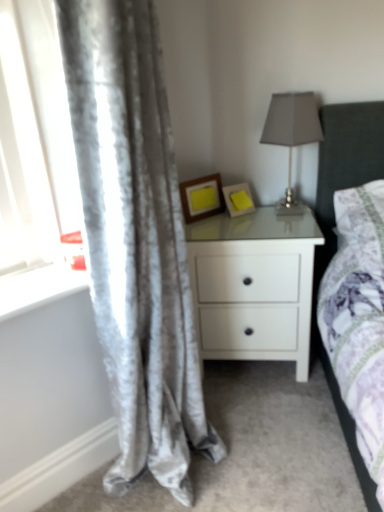
Question: Can you confirm if white glossy window sill at lower left is wider than white glossy nightstand at center?

Choices:
 (A) no
 (B) yes

Answer: (A)

Question: From the image's perspective, does white glossy window sill at lower left appear higher than white glossy nightstand at center?

Choices:
 (A) yes
 (B) no

Answer: (A)

Question: Is white glossy window sill at lower left positioned behind white glossy nightstand at center?

Choices:
 (A) yes
 (B) no

Answer: (B)

Question: From the image's perspective, is white glossy window sill at lower left under white glossy nightstand at center?

Choices:
 (A) no
 (B) yes

Answer: (A)

Question: Could you tell me if white glossy window sill at lower left is turned towards white glossy nightstand at center?

Choices:
 (A) yes
 (B) no

Answer: (B)

Question: Is satin gray lampshade at upper right bigger or smaller than yellow matte picture frame at upper center, placed as the second picture frame when sorted from left to right?

Choices:
 (A) big
 (B) small

Answer: (A)

Question: Relative to yellow matte picture frame at upper center, which ranks as the first picture frame in right-to-left order, is satin gray lampshade at upper right in front or behind?

Choices:
 (A) behind
 (B) front

Answer: (B)

Question: Is point (286, 105) positioned closer to the camera than point (235, 214)?

Choices:
 (A) farther
 (B) closer

Answer: (B)

Question: Is satin gray lampshade at upper right to the left or to the right of yellow matte picture frame at upper center, placed as the second picture frame when sorted from left to right, in the image?

Choices:
 (A) right
 (B) left

Answer: (A)

Question: Looking at their shapes, would you say white glossy nightstand at center is wider or thinner than yellow matte picture frame at center, placed as the 2th picture frame when sorted from right to left?

Choices:
 (A) thin
 (B) wide

Answer: (B)

Question: In terms of size, does white glossy nightstand at center appear bigger or smaller than yellow matte picture frame at center, which is counted as the first picture frame, starting from the left?

Choices:
 (A) big
 (B) small

Answer: (A)

Question: Is white glossy nightstand at center spatially inside yellow matte picture frame at center, which is counted as the first picture frame, starting from the left, or outside of it?

Choices:
 (A) inside
 (B) outside

Answer: (B)

Question: In terms of height, does white glossy nightstand at center look taller or shorter compared to yellow matte picture frame at center, which is counted as the first picture frame, starting from the left?

Choices:
 (A) tall
 (B) short

Answer: (A)

Question: Considering the positions of yellow matte picture frame at center, placed as the 2th picture frame when sorted from right to left, and satin gray lampshade at upper right in the image, is yellow matte picture frame at center, placed as the 2th picture frame when sorted from right to left, taller or shorter than satin gray lampshade at upper right?

Choices:
 (A) short
 (B) tall

Answer: (A)

Question: Considering their positions, is yellow matte picture frame at center, placed as the 2th picture frame when sorted from right to left, located in front of or behind satin gray lampshade at upper right?

Choices:
 (A) front
 (B) behind

Answer: (B)